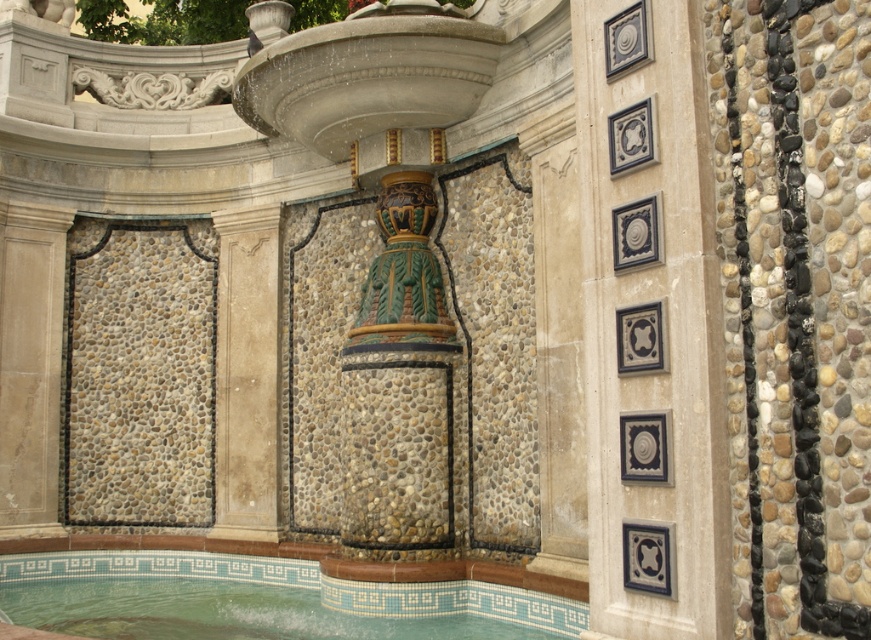
Question: Which point is farther from the camera taking this photo?

Choices:
 (A) (581, 595)
 (B) (670, 420)

Answer: (A)

Question: Among these points, which one is nearest to the camera?

Choices:
 (A) (618, 632)
 (B) (409, 604)

Answer: (A)

Question: Which object appears farthest from the camera in this image?

Choices:
 (A) green mosaic tile pool at center
 (B) dark gray stone tiles at center

Answer: (A)

Question: Does dark gray stone tiles at center have a greater width compared to green mosaic tile pool at center?

Choices:
 (A) no
 (B) yes

Answer: (A)

Question: Is the position of dark gray stone tiles at center less distant than that of green mosaic tile pool at center?

Choices:
 (A) yes
 (B) no

Answer: (A)

Question: Can you confirm if dark gray stone tiles at center is wider than green mosaic tile pool at center?

Choices:
 (A) yes
 (B) no

Answer: (B)